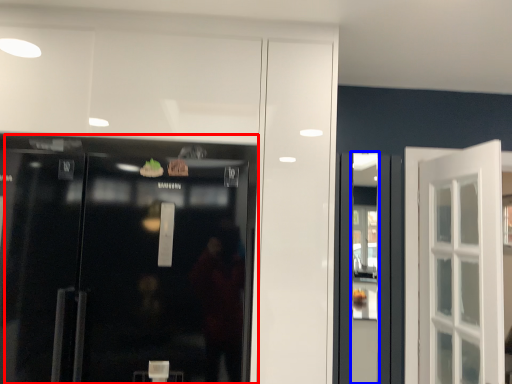
Question: Which point is further to the camera, door (highlighted by a red box) or shop window (highlighted by a blue box)?

Choices:
 (A) door
 (B) shop window

Answer: (B)